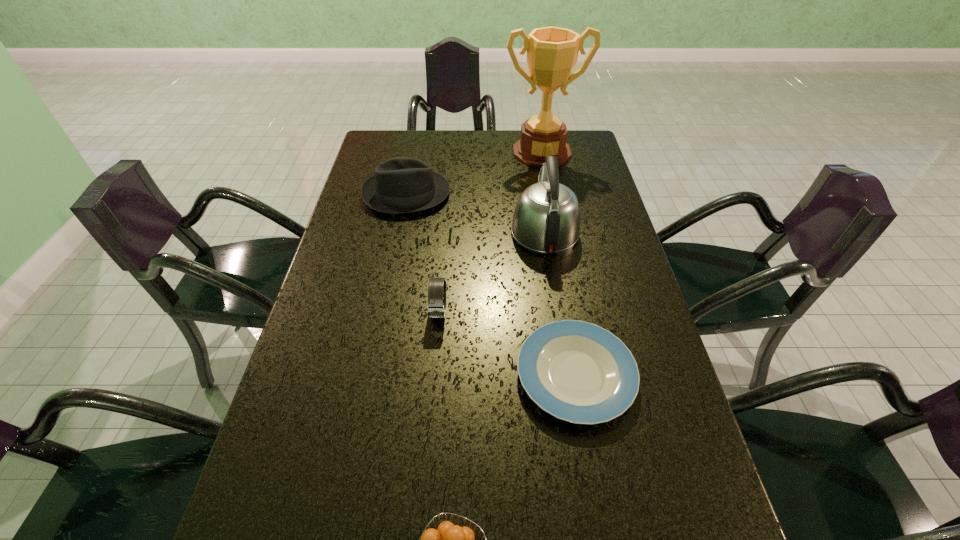
The image size is (960, 540). I want to click on object positioned at the far right corner, so click(552, 52).

The height and width of the screenshot is (540, 960). Identify the location of vacant region at the far edge. (439, 140).

At what (x,y) coordinates should I click in order to perform the action: click on free region at the left edge. Please return your answer as a coordinate pair (x, y). The image size is (960, 540). Looking at the image, I should click on (373, 235).

At what (x,y) coordinates should I click in order to perform the action: click on free spot at the right edge of the desktop. Please return your answer as a coordinate pair (x, y). Image resolution: width=960 pixels, height=540 pixels. Looking at the image, I should click on (594, 301).

At what (x,y) coordinates should I click in order to perform the action: click on vacant space at the far left corner. Please return your answer as a coordinate pair (x, y). Image resolution: width=960 pixels, height=540 pixels. Looking at the image, I should click on (415, 133).

Locate an element on the screen. Image resolution: width=960 pixels, height=540 pixels. vacant space that is in between the farthest object and the fedora is located at coordinates (474, 173).

Locate an element on the screen. blank region between the third nearest object and the second nearest object is located at coordinates (507, 343).

Locate an element on the screen. free point between the kettle and the plate is located at coordinates (560, 303).

Locate an element on the screen. vacant region between the tallest object and the plate is located at coordinates (559, 264).

Image resolution: width=960 pixels, height=540 pixels. What are the coordinates of `object that ranks as the fourth closest to the watch` in the screenshot? It's located at (448, 539).